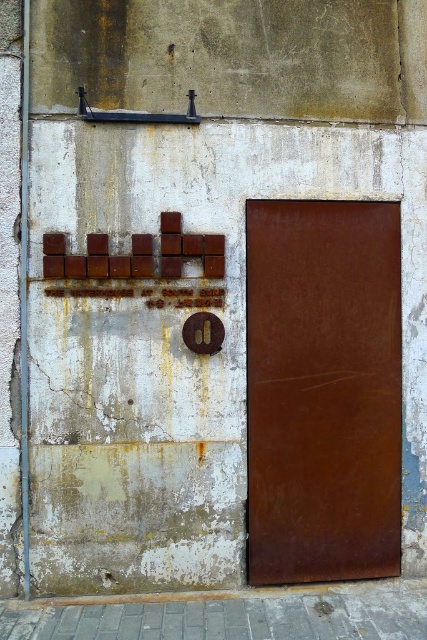
You are standing in front of the weathered wall and see two rusty metal doors. The first is the rusty metal door at center and the second is the rusty metal door at right. Which one is positioned higher on the wall?

The rusty metal door at center is positioned higher on the wall because it is located above the rusty metal door at right.

You are a painter who needs to place a ladder between the two rusty metal doors. The ladder is 30 centimeters wide. Can you fit the ladder between the rusty metal door at center and the rusty metal door at right?

The distance between the rusty metal door at center and the rusty metal door at right is 28.76 centimeters. Since the ladder is 30 centimeters wide, it cannot fit between them as the space is narrower than the ladder.

You are standing in front of the weathered wall and notice two points marked on it. The first point is at coordinates point (146, 129) and the second is at point (353, 202). If you were to reach out and touch one of them, which point would require you to stretch your arm further to touch?

Point (353, 202) is further away from the camera than point (146, 129), so you would need to stretch your arm further to touch point (353, 202).